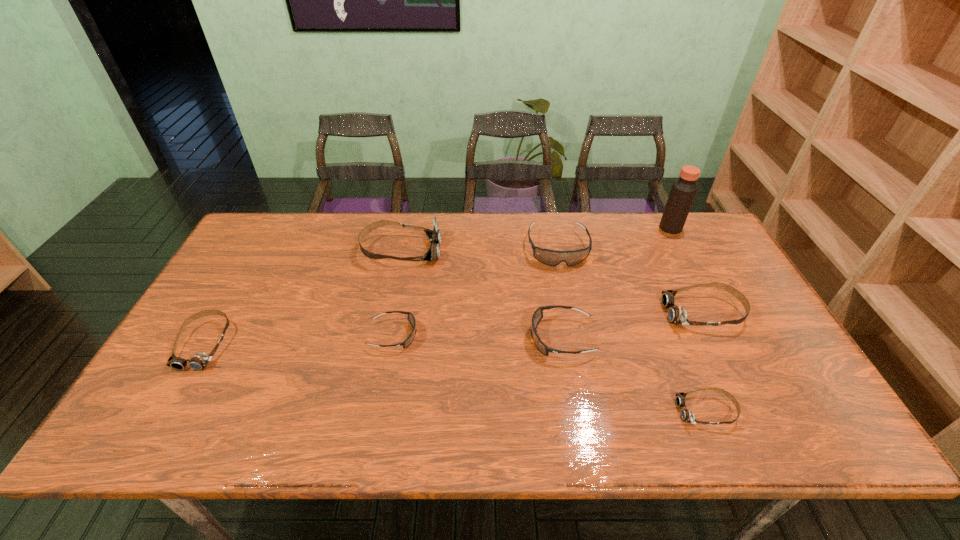
Where is `the third closest goggles relative to the second biggest black goggles`? This screenshot has width=960, height=540. the third closest goggles relative to the second biggest black goggles is located at coordinates (676, 315).

The width and height of the screenshot is (960, 540). Identify the location of the fourth closest goggles to the second smallest black goggles. (411, 318).

Locate which brown goggles is the fourth closest to the smallest black goggles. Please provide its 2D coordinates. Your answer should be formatted as a tuple, i.e. [(x, y)], where the tuple contains the x and y coordinates of a point satisfying the conditions above.

[(676, 315)]

This screenshot has height=540, width=960. I want to click on the third closest brown goggles to the second tallest object, so click(686, 415).

Identify the location of black goggles that stands as the closest to the leftmost object. This screenshot has width=960, height=540. (411, 318).

Locate an element on the screen. black goggles that stands as the second closest to the second smallest black goggles is located at coordinates (411, 318).

Locate an element on the screen. The width and height of the screenshot is (960, 540). free space in the image that satisfies the following two spatial constraints: 1. on the front side of the brown vinegar; 2. on the front-facing side of the smallest brown goggles is located at coordinates (767, 411).

The height and width of the screenshot is (540, 960). Identify the location of vacant space that satisfies the following two spatial constraints: 1. on the lenses of the second biggest black goggles; 2. on the front-facing side of the second smallest brown goggles. (563, 343).

Where is `vacant area in the image that satisfies the following two spatial constraints: 1. on the front side of the vinegar; 2. on the lenses of the second biggest black goggles`? Image resolution: width=960 pixels, height=540 pixels. vacant area in the image that satisfies the following two spatial constraints: 1. on the front side of the vinegar; 2. on the lenses of the second biggest black goggles is located at coordinates (728, 338).

Image resolution: width=960 pixels, height=540 pixels. What are the coordinates of `free region that satisfies the following two spatial constraints: 1. on the lenses of the second smallest black goggles; 2. on the front-facing side of the leftmost object` in the screenshot? It's located at (563, 343).